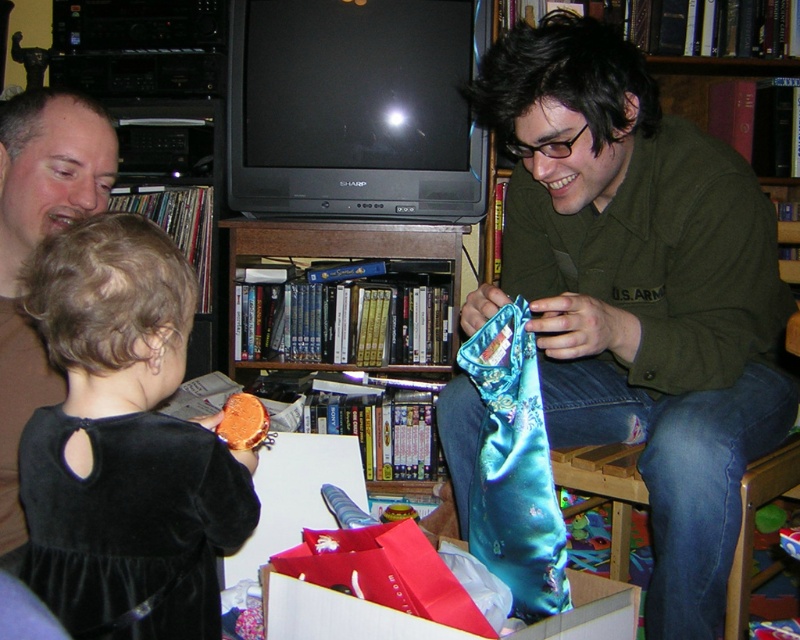
You are standing in the living room and need to find the brown velvet shirt at upper left. According to the coordinates provided, where should you look to locate it?

The brown velvet shirt at upper left is located at point (36,246), so you should look towards the upper left area of the room to find it.

You are an interior designer observing the living room scene. You need to hang a picture frame that is 1 meter tall between the brown velvet shirt at upper left and the teal satin tie at center. Can the space between them accommodate the frame?

The brown velvet shirt at upper left is taller than the teal satin tie at center. The height difference between them may allow the 1 meter tall picture frame to fit, but the exact vertical space isn answerable without knowing their exact positions. However, since the objects are described as being at specific locations, the vertical space between them might be sufficient. Please clarify the vertical distance between the two objects.

You are organizing a gift wrapping station and need to place the shiny blue silk pouch at center and the teal satin tie at center on a shelf. Which object should you place first if you want to arrange them from widest to narrowest?

The shiny blue silk pouch at center should be placed first since it is wider than the teal satin tie at center according to the description.